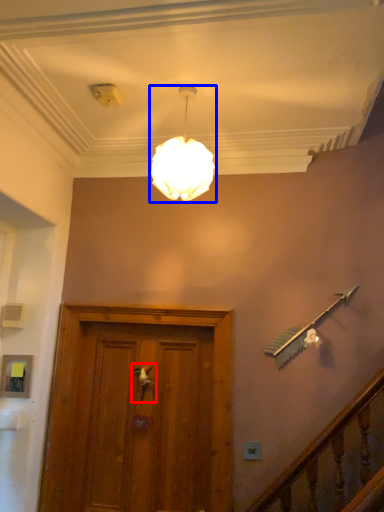
Question: Which of the following is the farthest to the observer, door handle (highlighted by a red box) or lamp (highlighted by a blue box)?

Choices:
 (A) door handle
 (B) lamp

Answer: (A)